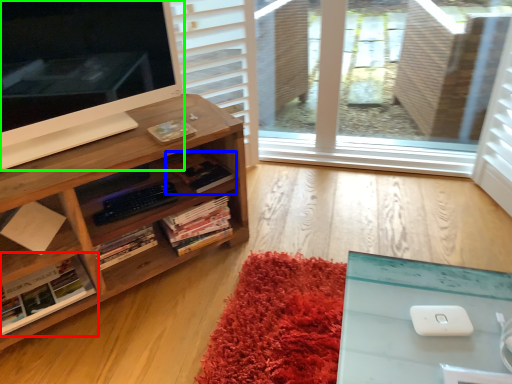
Question: Which is nearer to the book (highlighted by a red box)? book (highlighted by a blue box) or computer monitor (highlighted by a green box).

Choices:
 (A) book
 (B) computer monitor

Answer: (A)